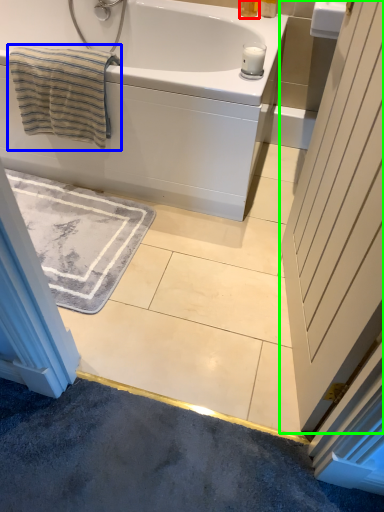
Question: Which is nearer to the toiletry (highlighted by a red box)? beach towel (highlighted by a blue box) or door (highlighted by a green box).

Choices:
 (A) beach towel
 (B) door

Answer: (A)